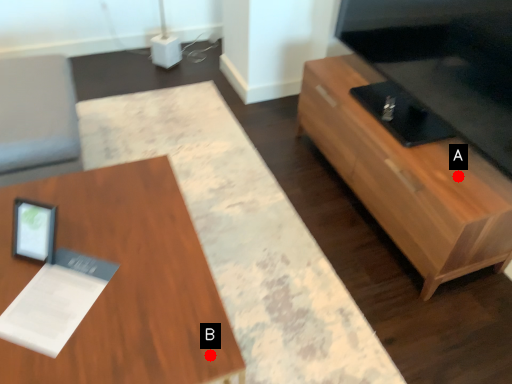
Question: Two points are circled on the image, labeled by A and B beside each circle. Which of the following is the closest to the observer?

Choices:
 (A) A is closer
 (B) B is closer

Answer: (B)